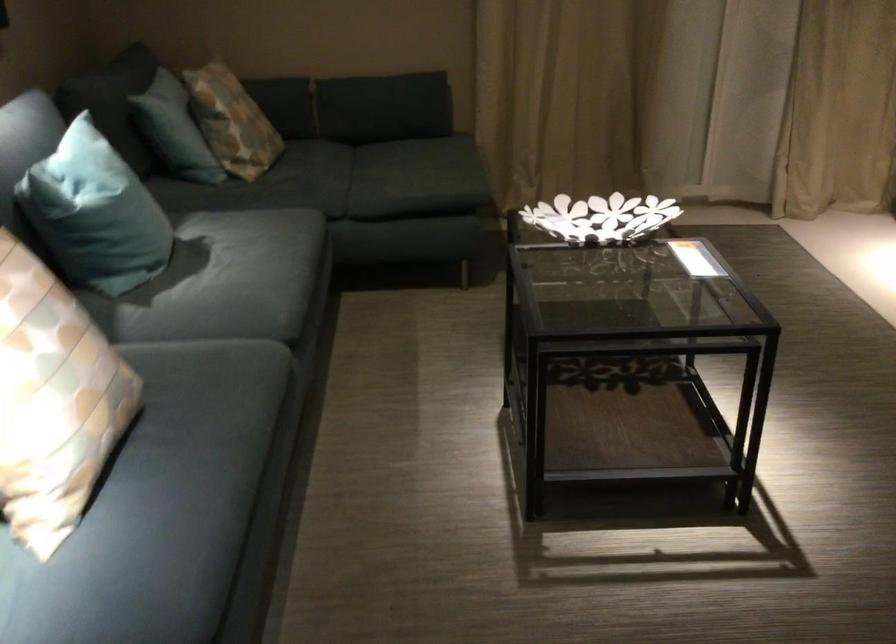
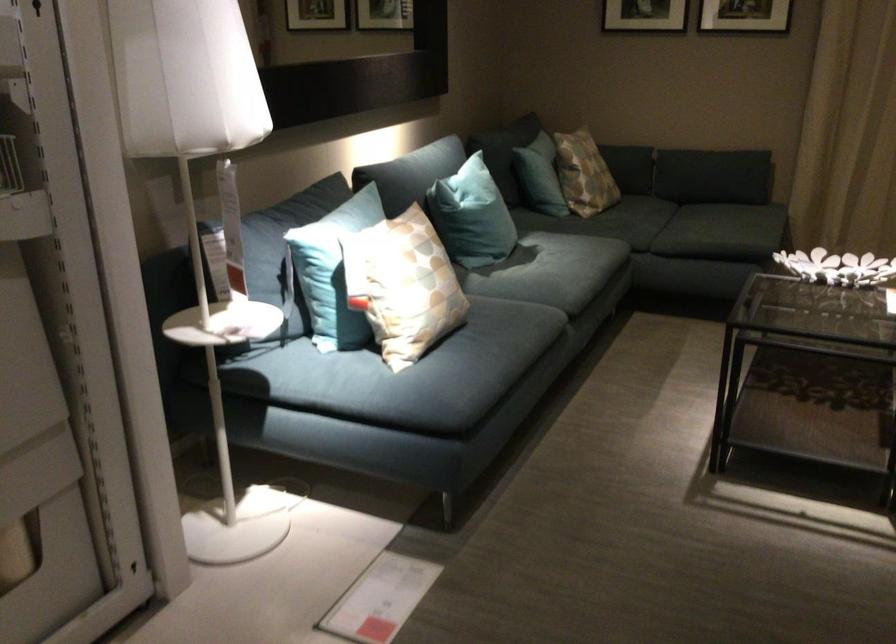
In the second image, find the point that corresponds to pixel 231 140 in the first image.

(583, 174)